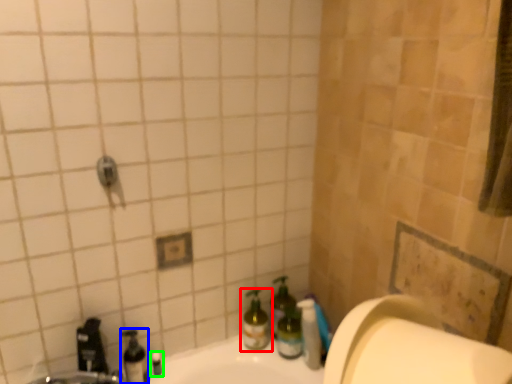
Question: Based on their relative distances, which object is nearer to bottle (highlighted by a red box)? Choose from bottle (highlighted by a blue box) and toiletry (highlighted by a green box).

Choices:
 (A) bottle
 (B) toiletry

Answer: (B)